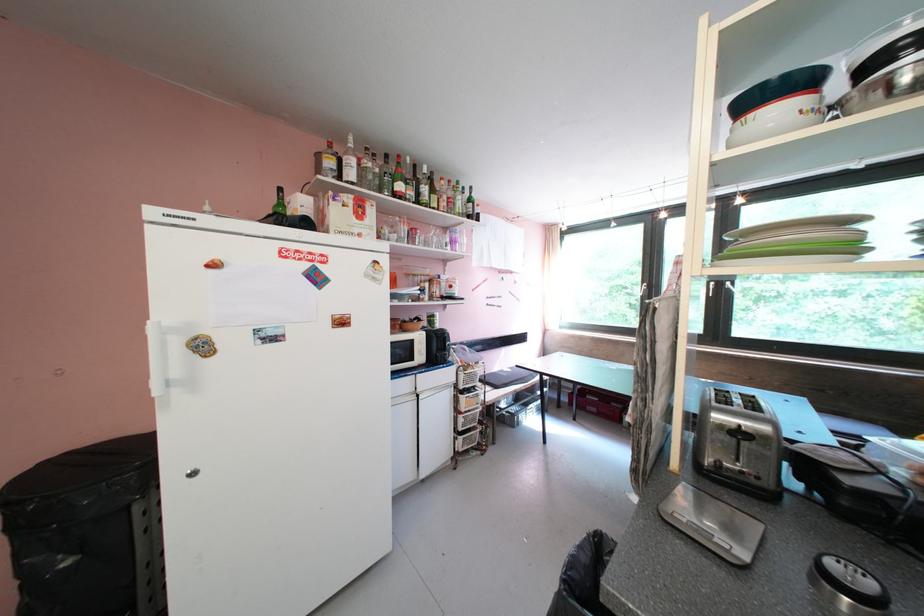
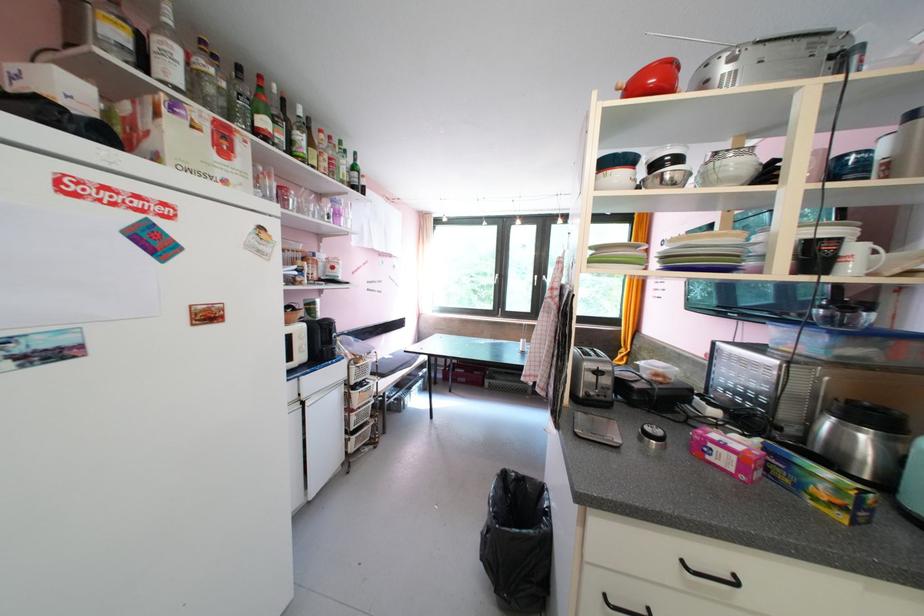
In the second image, find the point that corresponds to point (419, 196) in the first image.

(290, 140)